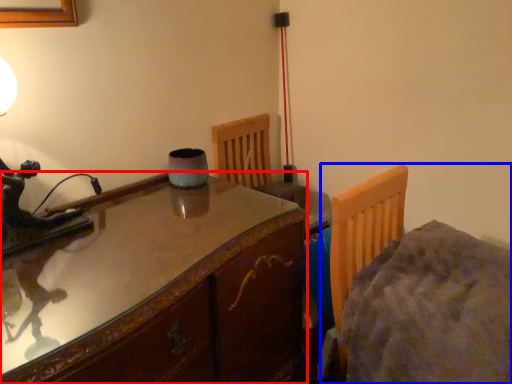
Question: Which of the following is the farthest to the observer, table (highlighted by a red box) or bed (highlighted by a blue box)?

Choices:
 (A) table
 (B) bed

Answer: (B)